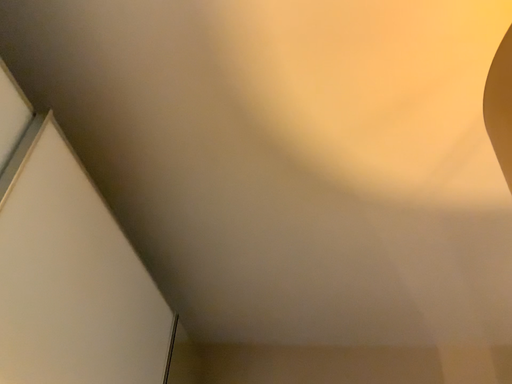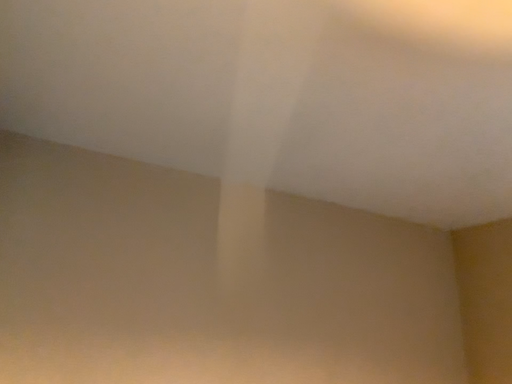
Question: Which way did the camera rotate in the video?

Choices:
 (A) rotated downward
 (B) rotated upward

Answer: (A)